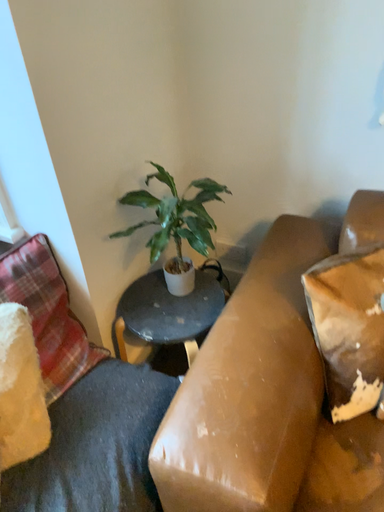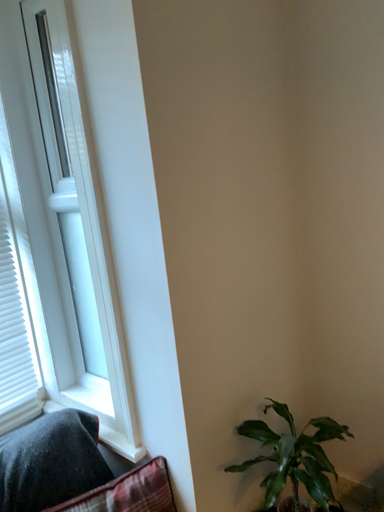
Question: Which way did the camera rotate in the video?

Choices:
 (A) rotated downward
 (B) rotated upward

Answer: (B)